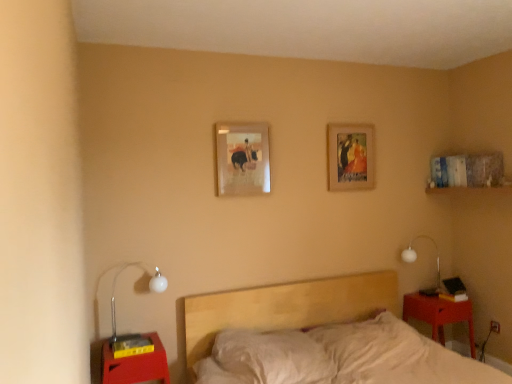
Question: From the image's perspective, does light wood bed at center appear higher than matte red wood nightstand at lower right, the first nightstand positioned from the back?

Choices:
 (A) no
 (B) yes

Answer: (B)

Question: Is light wood bed at center turned away from matte red wood nightstand at lower right, marked as the first nightstand in a right-to-left arrangement?

Choices:
 (A) no
 (B) yes

Answer: (A)

Question: Considering the relative positions of light wood bed at center and matte red wood nightstand at lower right, marked as the first nightstand in a right-to-left arrangement, in the image provided, is light wood bed at center to the left of matte red wood nightstand at lower right, marked as the first nightstand in a right-to-left arrangement, from the viewer's perspective?

Choices:
 (A) no
 (B) yes

Answer: (B)

Question: Is the position of light wood bed at center less distant than that of matte red wood nightstand at lower right, marked as the first nightstand in a right-to-left arrangement?

Choices:
 (A) no
 (B) yes

Answer: (B)

Question: Is the surface of light wood bed at center in direct contact with matte red wood nightstand at lower right, placed as the 2th nightstand when sorted from front to back?

Choices:
 (A) no
 (B) yes

Answer: (A)

Question: Does point (359, 288) appear closer or farther from the camera than point (117, 336)?

Choices:
 (A) closer
 (B) farther

Answer: (B)

Question: From a real-world perspective, is light wood bed at center above or below white glass lamp at left, which is the first lamp from left to right?

Choices:
 (A) above
 (B) below

Answer: (B)

Question: Considering the positions of light wood bed at center and white glass lamp at left, arranged as the 1th lamp when viewed from the front, in the image, is light wood bed at center taller or shorter than white glass lamp at left, arranged as the 1th lamp when viewed from the front,?

Choices:
 (A) tall
 (B) short

Answer: (A)

Question: Considering their positions, is light wood bed at center located in front of or behind white glass lamp at left, arranged as the 1th lamp when viewed from the front?

Choices:
 (A) behind
 (B) front

Answer: (B)

Question: In terms of size, does light wood bed at center appear bigger or smaller than matte wooden picture frame at center, which is counted as the 2th picture frame, starting from the back?

Choices:
 (A) small
 (B) big

Answer: (B)

Question: Relative to matte wooden picture frame at center, which is counted as the 2th picture frame, starting from the back, is light wood bed at center in front or behind?

Choices:
 (A) behind
 (B) front

Answer: (B)

Question: From the image's perspective, is light wood bed at center above or below matte wooden picture frame at center, which is the first picture frame from front to back?

Choices:
 (A) above
 (B) below

Answer: (B)

Question: Would you say light wood bed at center is to the left or to the right of matte wooden picture frame at center, which is counted as the first picture frame, starting from the left, in the picture?

Choices:
 (A) left
 (B) right

Answer: (B)

Question: From the image's perspective, is matte red nightstand at lower left, the first nightstand when ordered from left to right, located above or below wooden picture frame at upper center, the 2th picture frame from the front?

Choices:
 (A) above
 (B) below

Answer: (B)

Question: Do you think matte red nightstand at lower left, which is the first nightstand in front-to-back order, is within wooden picture frame at upper center, arranged as the 2th picture frame when viewed from the left, or outside of it?

Choices:
 (A) inside
 (B) outside

Answer: (B)